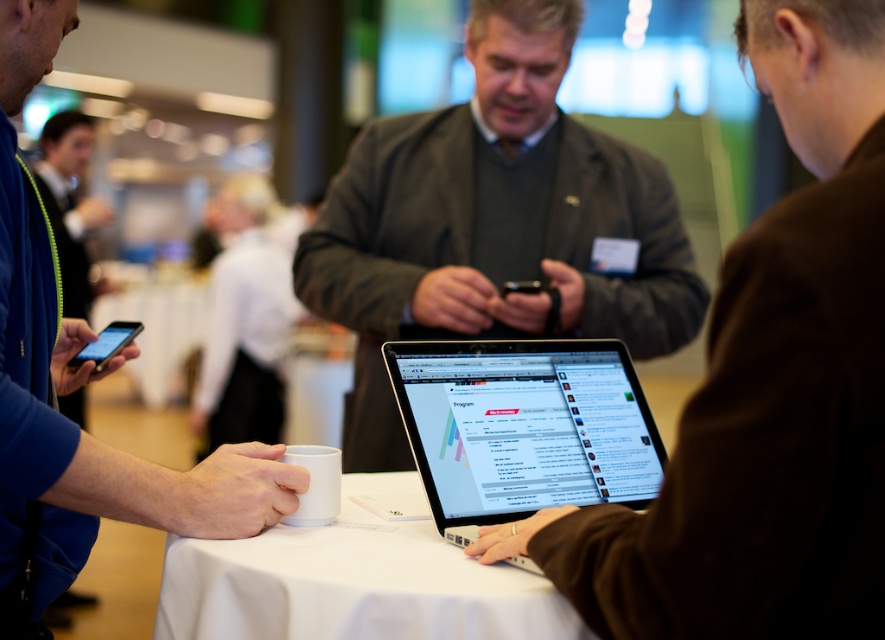
Question: Among these points, which one is farthest from the camera?

Choices:
 (A) (618, 426)
 (B) (860, 349)
 (C) (273, 516)

Answer: (A)

Question: Is dark gray sweater at center to the right of white matte cup at lower center from the viewer's perspective?

Choices:
 (A) yes
 (B) no

Answer: (A)

Question: Which object is closer to the camera taking this photo?

Choices:
 (A) matte black laptop at center
 (B) satin black laptop at center

Answer: (A)

Question: Does satin black laptop at center have a lesser width compared to white matte cup at lower center?

Choices:
 (A) yes
 (B) no

Answer: (A)

Question: Among these points, which one is farthest from the camera?

Choices:
 (A) (82, 460)
 (B) (732, 600)

Answer: (A)

Question: Can you confirm if dark gray sweater at center is positioned to the right of satin black laptop at center?

Choices:
 (A) yes
 (B) no

Answer: (B)